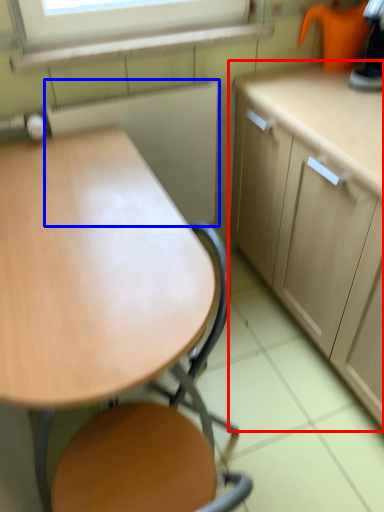
Question: Among these objects, which one is farthest to the camera, cabinetry (highlighted by a red box) or appliance (highlighted by a blue box)?

Choices:
 (A) cabinetry
 (B) appliance

Answer: (B)